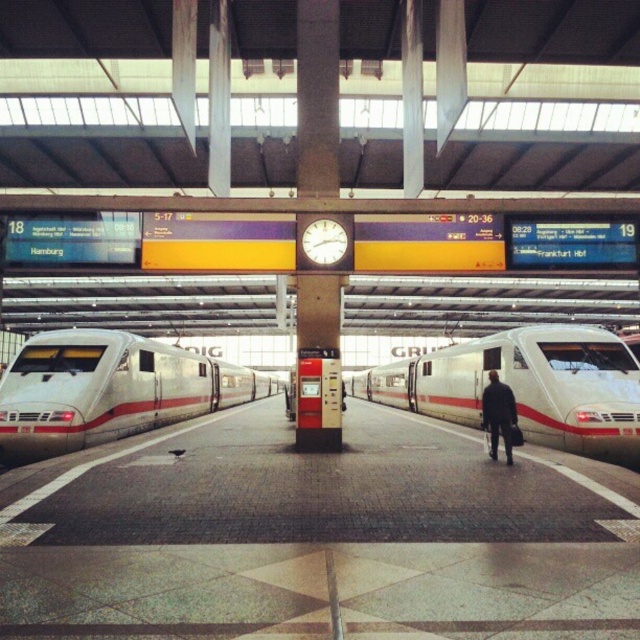
Can you confirm if silver metallic train at left is wider than dark blue suit at center?

Indeed, silver metallic train at left has a greater width compared to dark blue suit at center.

Can you confirm if silver metallic train at left is positioned to the right of dark blue suit at center?

Incorrect, silver metallic train at left is not on the right side of dark blue suit at center.

At what (x,y) coordinates should I click in order to perform the action: click on silver metallic train at left. Please return your answer as a coordinate pair (x, y). The width and height of the screenshot is (640, 640). Looking at the image, I should click on (108, 390).

Can you confirm if white glossy train at center is taller than dark blue suit at center?

Correct, white glossy train at center is much taller as dark blue suit at center.

Is white glossy train at center smaller than dark blue suit at center?

Incorrect, white glossy train at center is not smaller in size than dark blue suit at center.

You are a GUI agent. You are given a task and a screenshot of the screen. Output one action in this format:
    pyautogui.click(x=<x>, y=<y>)
    Task: Click on the white glossy train at center
    
    Given the screenshot: What is the action you would take?
    pyautogui.click(x=525, y=387)

Between white glossy train at center and silver metallic train at left, which one has more height?

With more height is silver metallic train at left.

Which is more to the left, white glossy train at center or silver metallic train at left?

From the viewer's perspective, silver metallic train at left appears more on the left side.

Measure the distance between white glossy train at center and camera.

They are 13.38 meters apart.

Image resolution: width=640 pixels, height=640 pixels. What are the coordinates of `white glossy train at center` in the screenshot? It's located at (525, 387).